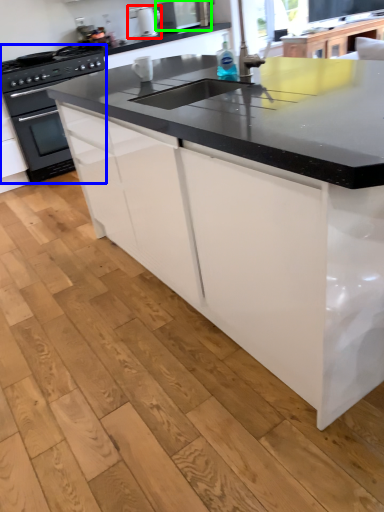
Question: Based on their relative distances, which object is farther from appliance (highlighted by a red box)? Choose from home appliance (highlighted by a blue box) and kitchen appliance (highlighted by a green box).

Choices:
 (A) home appliance
 (B) kitchen appliance

Answer: (A)